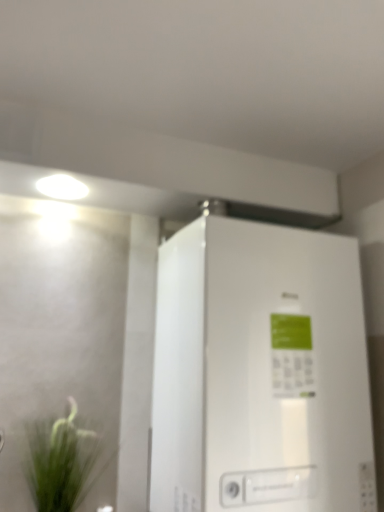
Question: Can you confirm if green grass at lower left is wider than white glossy refrigerator at center?

Choices:
 (A) yes
 (B) no

Answer: (B)

Question: From the image's perspective, is green grass at lower left over white glossy refrigerator at center?

Choices:
 (A) no
 (B) yes

Answer: (A)

Question: From a real-world perspective, is green grass at lower left on top of white glossy refrigerator at center?

Choices:
 (A) yes
 (B) no

Answer: (B)

Question: From the image's perspective, is green grass at lower left below white glossy refrigerator at center?

Choices:
 (A) no
 (B) yes

Answer: (B)

Question: Is green grass at lower left oriented away from white glossy refrigerator at center?

Choices:
 (A) yes
 (B) no

Answer: (B)

Question: From a real-world perspective, does green grass at lower left sit lower than white glossy refrigerator at center?

Choices:
 (A) no
 (B) yes

Answer: (B)

Question: Is white glossy refrigerator at center oriented towards green grass at lower left?

Choices:
 (A) yes
 (B) no

Answer: (B)

Question: Are white glossy refrigerator at center and green grass at lower left located far from each other?

Choices:
 (A) yes
 (B) no

Answer: (B)

Question: Is white glossy refrigerator at center wider than green grass at lower left?

Choices:
 (A) no
 (B) yes

Answer: (B)

Question: From the image's perspective, is white glossy refrigerator at center on top of green grass at lower left?

Choices:
 (A) no
 (B) yes

Answer: (B)

Question: Is white glossy refrigerator at center at the left side of green grass at lower left?

Choices:
 (A) no
 (B) yes

Answer: (A)

Question: From a real-world perspective, is white glossy refrigerator at center positioned over green grass at lower left based on gravity?

Choices:
 (A) yes
 (B) no

Answer: (A)

Question: Considering the positions of green grass at lower left and white glossy refrigerator at center in the image, is green grass at lower left wider or thinner than white glossy refrigerator at center?

Choices:
 (A) thin
 (B) wide

Answer: (A)